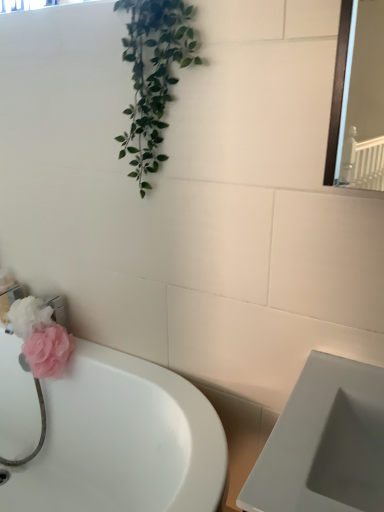
Question: Is pink fabric flower at lower left facing away from white glossy bathtub at lower left?

Choices:
 (A) no
 (B) yes

Answer: (A)

Question: Can you confirm if pink fabric flower at lower left is bigger than white glossy bathtub at lower left?

Choices:
 (A) yes
 (B) no

Answer: (B)

Question: Is pink fabric flower at lower left located outside white glossy bathtub at lower left?

Choices:
 (A) yes
 (B) no

Answer: (B)

Question: Can you confirm if pink fabric flower at lower left is thinner than white glossy bathtub at lower left?

Choices:
 (A) no
 (B) yes

Answer: (B)

Question: Is pink fabric flower at lower left wider than white glossy bathtub at lower left?

Choices:
 (A) no
 (B) yes

Answer: (A)

Question: Is pink fabric flower at lower left beside white glossy bathtub at lower left?

Choices:
 (A) no
 (B) yes

Answer: (A)

Question: Is white glossy bathtub at lower left directly adjacent to pink fabric flower at lower left?

Choices:
 (A) yes
 (B) no

Answer: (B)

Question: From the image's perspective, is white glossy bathtub at lower left over pink fabric flower at lower left?

Choices:
 (A) no
 (B) yes

Answer: (A)

Question: Can you confirm if white glossy bathtub at lower left is thinner than pink fabric flower at lower left?

Choices:
 (A) no
 (B) yes

Answer: (A)

Question: Considering the relative sizes of white glossy bathtub at lower left and pink fabric flower at lower left in the image provided, is white glossy bathtub at lower left taller than pink fabric flower at lower left?

Choices:
 (A) yes
 (B) no

Answer: (A)

Question: From a real-world perspective, is white glossy bathtub at lower left over pink fabric flower at lower left?

Choices:
 (A) no
 (B) yes

Answer: (A)

Question: Is white glossy bathtub at lower left oriented towards pink fabric flower at lower left?

Choices:
 (A) yes
 (B) no

Answer: (B)

Question: Considering the positions of point (41, 332) and point (41, 475), is point (41, 332) closer or farther from the camera than point (41, 475)?

Choices:
 (A) closer
 (B) farther

Answer: (A)